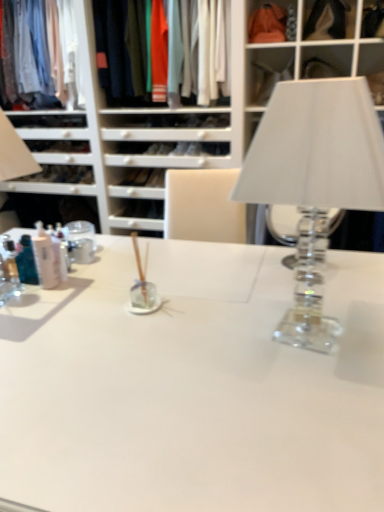
What is the approximate height of matte orange fabric at upper center?

It is 8.37 inches.

What is the approximate width of matte orange fabric at upper center?

The width of matte orange fabric at upper center is 10.44 inches.

What is the approximate height of matte cotton shirts at upper center, which is the 2th clothing from left to right?

matte cotton shirts at upper center, which is the 2th clothing from left to right, is 28.51 inches tall.

Measure the distance between point (295, 129) and camera.

Point (295, 129) is 32.28 inches away from camera.

What do you see at coordinates (315, 179) in the screenshot?
I see `clear glass table lamp at right` at bounding box center [315, 179].

Locate an element on the screen. This screenshot has height=512, width=384. translucent plastic bottles at left is located at coordinates (46, 258).

Considering the positions of point (35, 243) and point (295, 132), is point (35, 243) closer or farther from the camera than point (295, 132)?

Point (35, 243) is farther from the camera than point (295, 132).

Is translucent plastic bottles at left spatially inside clear glass table lamp at right, or outside of it?

translucent plastic bottles at left is located beyond the bounds of clear glass table lamp at right.

Is translucent plastic bottles at left bigger or smaller than clear glass table lamp at right?

Clearly, translucent plastic bottles at left is smaller in size than clear glass table lamp at right.

Considering the sizes of objects translucent plastic bottles at left and clear glass table lamp at right in the image provided, who is thinner, translucent plastic bottles at left or clear glass table lamp at right?

translucent plastic bottles at left is thinner.

Considering the relative sizes of matte cotton shirts at upper center, the 1th clothing from the right, and matte orange fabric at upper center in the image provided, is matte cotton shirts at upper center, the 1th clothing from the right, taller than matte orange fabric at upper center?

Indeed, matte cotton shirts at upper center, the 1th clothing from the right, has a greater height compared to matte orange fabric at upper center.

Where is `the 2nd clothing positioned below the matte orange fabric at upper center (from a real-world perspective)`? Image resolution: width=384 pixels, height=512 pixels. the 2nd clothing positioned below the matte orange fabric at upper center (from a real-world perspective) is located at coordinates (121, 51).

Measure the distance from matte cotton shirts at upper center, the 1th clothing from the right, to matte orange fabric at upper center.

matte cotton shirts at upper center, the 1th clothing from the right, is 31.66 inches away from matte orange fabric at upper center.

Could you tell me if matte cotton shirts at upper center, the 1th clothing from the right, is facing matte orange fabric at upper center?

No, matte cotton shirts at upper center, the 1th clothing from the right, is not facing towards matte orange fabric at upper center.

Looking at the image, does matte cotton shirts at upper center, which is the 2th clothing from left to right, seem bigger or smaller compared to matte cotton shirt at upper left, which is the 1th clothing from left to right?

matte cotton shirts at upper center, which is the 2th clothing from left to right, is bigger than matte cotton shirt at upper left, which is the 1th clothing from left to right.

How different are the orientations of matte cotton shirts at upper center, the 1th clothing from the right, and matte cotton shirt at upper left, placed as the second clothing when sorted from right to left, in degrees?

matte cotton shirts at upper center, the 1th clothing from the right, and matte cotton shirt at upper left, placed as the second clothing when sorted from right to left, are facing 0.381 degrees away from each other.

Is matte cotton shirts at upper center, the 1th clothing from the right, spatially inside matte cotton shirt at upper left, placed as the second clothing when sorted from right to left, or outside of it?

matte cotton shirts at upper center, the 1th clothing from the right, lies outside matte cotton shirt at upper left, placed as the second clothing when sorted from right to left.

Who is taller, matte cotton shirts at upper center, the 1th clothing from the right, or matte cotton shirt at upper left, which is the 1th clothing from left to right?

matte cotton shirt at upper left, which is the 1th clothing from left to right, is taller.

Considering the sizes of objects clear glass table lamp at right and translucent plastic bottles at left in the image provided, who is bigger, clear glass table lamp at right or translucent plastic bottles at left?

clear glass table lamp at right.

Is point (363, 96) positioned in front of point (42, 255)?

That is True.

From the image's perspective, who appears lower, clear glass table lamp at right or translucent plastic bottles at left?

translucent plastic bottles at left.

What's the angular difference between clear glass table lamp at right and translucent plastic bottles at left's facing directions?

101 degrees separate the facing orientations of clear glass table lamp at right and translucent plastic bottles at left.

Can you confirm if matte orange fabric at upper center is bigger than translucent plastic bottles at left?

Indeed, matte orange fabric at upper center has a larger size compared to translucent plastic bottles at left.

Who is more distant, matte orange fabric at upper center or translucent plastic bottles at left?

matte orange fabric at upper center is more distant.

Is translucent plastic bottles at left surrounded by matte orange fabric at upper center?

No, matte orange fabric at upper center does not contain translucent plastic bottles at left.

Which point is more forward, [286,37] or [47,278]?

The point [47,278] is more forward.

Considering the relative sizes of clear glass table lamp at right and matte cotton shirts at upper center, which is the 2th clothing from left to right, in the image provided, is clear glass table lamp at right shorter than matte cotton shirts at upper center, which is the 2th clothing from left to right,?

Yes, clear glass table lamp at right is shorter than matte cotton shirts at upper center, which is the 2th clothing from left to right.

The height and width of the screenshot is (512, 384). What are the coordinates of `table lamp in front of the matte cotton shirts at upper center, which is the 2th clothing from left to right` in the screenshot? It's located at (315, 179).

Does clear glass table lamp at right appear on the right side of matte cotton shirts at upper center, which is the 2th clothing from left to right?

Yes, clear glass table lamp at right is to the right of matte cotton shirts at upper center, which is the 2th clothing from left to right.

Where is `table lamp in front of the matte orange fabric at upper center`? The width and height of the screenshot is (384, 512). table lamp in front of the matte orange fabric at upper center is located at coordinates click(x=315, y=179).

Is clear glass table lamp at right beside matte orange fabric at upper center?

There is a gap between clear glass table lamp at right and matte orange fabric at upper center.

Is clear glass table lamp at right located outside matte orange fabric at upper center?

Yes.

Could you tell me if clear glass table lamp at right is facing matte orange fabric at upper center?

No, clear glass table lamp at right is not oriented towards matte orange fabric at upper center.

Where is `table lamp in front of the translucent plastic bottles at left`? table lamp in front of the translucent plastic bottles at left is located at coordinates (315, 179).

In the image, there is a matte orange fabric at upper center. Where is `clothing below it (from the image's perspective)`? clothing below it (from the image's perspective) is located at coordinates (121, 51).

Considering their positions, is clear glass table lamp at right positioned closer to matte orange fabric at upper center than matte cotton shirts at upper center, the 1th clothing from the right?

matte cotton shirts at upper center, the 1th clothing from the right, is positioned closer to the anchor matte orange fabric at upper center.

Based on their spatial positions, is translucent plastic bottles at left or matte orange fabric at upper center closer to clear glass table lamp at right?

translucent plastic bottles at left is closer to clear glass table lamp at right.

Considering their positions, is matte orange fabric at upper center positioned closer to matte cotton shirt at upper left, which is the 1th clothing from left to right, than translucent plastic bottles at left?

matte orange fabric at upper center is positioned closer to the anchor matte cotton shirt at upper left, which is the 1th clothing from left to right.

Looking at this image, estimate the real-world distances between objects in this image. Which object is closer to clear glass table lamp at right, matte cotton shirt at upper left, placed as the second clothing when sorted from right to left, or translucent plastic bottles at left?

Among the two, translucent plastic bottles at left is located nearer to clear glass table lamp at right.

Which object lies nearer to the anchor point matte cotton shirt at upper left, which is the 1th clothing from left to right, matte orange fabric at upper center or clear glass table lamp at right?

matte orange fabric at upper center is positioned closer to the anchor matte cotton shirt at upper left, which is the 1th clothing from left to right.

Looking at the image, which one is located closer to matte cotton shirt at upper left, placed as the second clothing when sorted from right to left, translucent plastic bottles at left or matte orange fabric at upper center?

Among the two, matte orange fabric at upper center is located nearer to matte cotton shirt at upper left, placed as the second clothing when sorted from right to left.

Based on their spatial positions, is matte cotton shirt at upper left, placed as the second clothing when sorted from right to left, or matte orange fabric at upper center closer to matte cotton shirts at upper center, the 1th clothing from the right?

matte cotton shirt at upper left, placed as the second clothing when sorted from right to left, lies closer to matte cotton shirts at upper center, the 1th clothing from the right, than the other object.

Estimate the real-world distances between objects in this image. Which object is further from matte orange fabric at upper center, matte cotton shirts at upper center, the 1th clothing from the right, or matte cotton shirt at upper left, which is the 1th clothing from left to right?

matte cotton shirt at upper left, which is the 1th clothing from left to right, is further to matte orange fabric at upper center.

At what (x,y) coordinates should I click in order to perform the action: click on cabinet between matte cotton shirt at upper left, which is the 1th clothing from left to right, and translucent plastic bottles at left from top to bottom. Please return your answer as a coordinate pair (x, y). Looking at the image, I should click on (272, 24).

The height and width of the screenshot is (512, 384). Identify the location of cabinet positioned between clear glass table lamp at right and matte cotton shirts at upper center, the 1th clothing from the right, from near to far. point(272,24).

Where is `cabinet between clear glass table lamp at right and matte cotton shirt at upper left, placed as the second clothing when sorted from right to left, in the front-back direction`? The height and width of the screenshot is (512, 384). cabinet between clear glass table lamp at right and matte cotton shirt at upper left, placed as the second clothing when sorted from right to left, in the front-back direction is located at coordinates (272, 24).

You are a GUI agent. You are given a task and a screenshot of the screen. Output one action in this format:
    pyautogui.click(x=<x>, y=<y>)
    Task: Click on the toiletry between clear glass table lamp at right and matte cotton shirt at upper left, placed as the second clothing when sorted from right to left, in the front-back direction
    This screenshot has height=512, width=384.
    Given the screenshot: What is the action you would take?
    pyautogui.click(x=46, y=258)